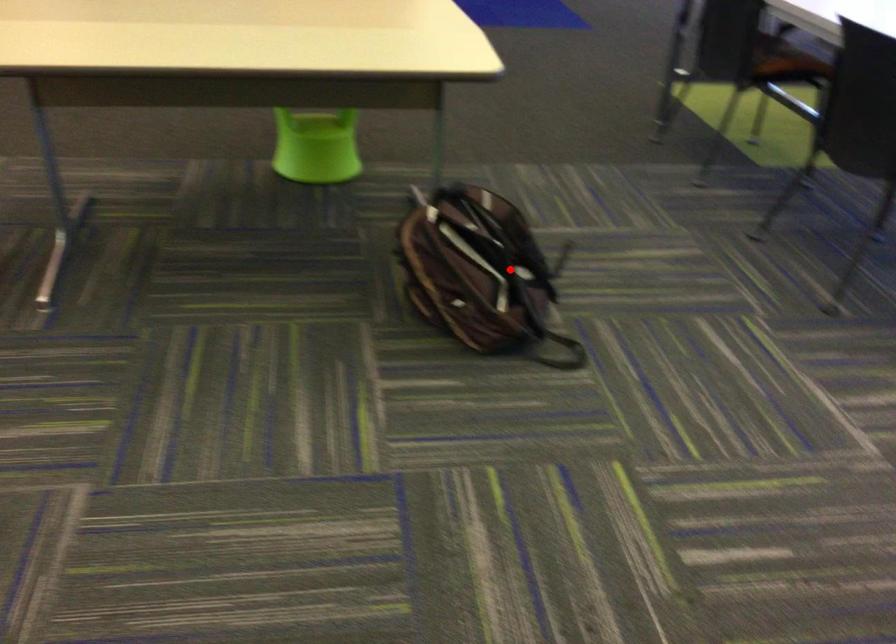
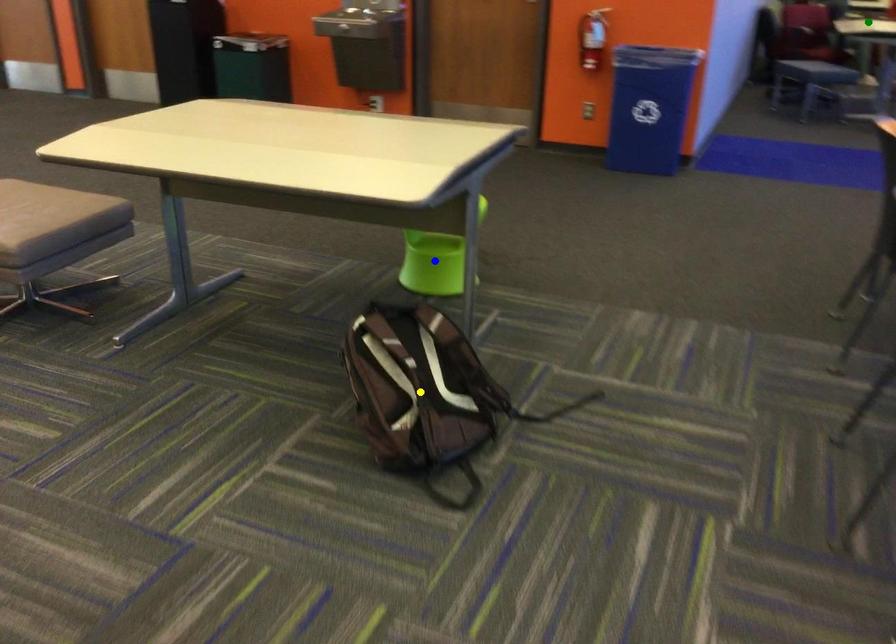
Question: I am providing you with two images of the same scene from different viewpoints. A red point is marked on the first image. You are given multiple points on the second image. Which mark in image 2 goes with the point in image 1?

Choices:
 (A) yellow point
 (B) blue point
 (C) green point

Answer: (A)